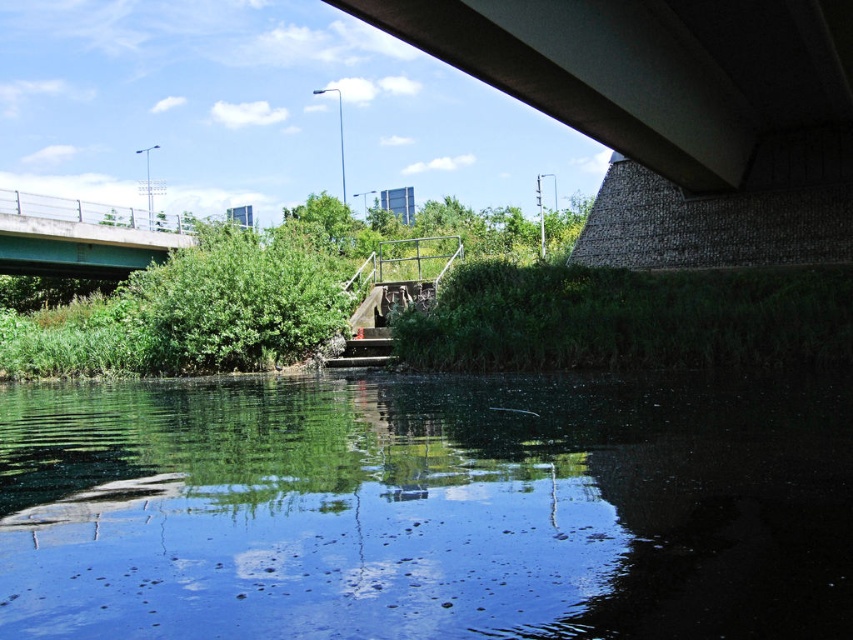
Between clear water at center and green painted concrete bridge at upper left, which one appears on the right side from the viewer's perspective?

From the viewer's perspective, clear water at center appears more on the right side.

Is clear water at center shorter than green painted concrete bridge at upper left?

Correct, clear water at center is not as tall as green painted concrete bridge at upper left.

The width and height of the screenshot is (853, 640). I want to click on clear water at center, so click(x=427, y=508).